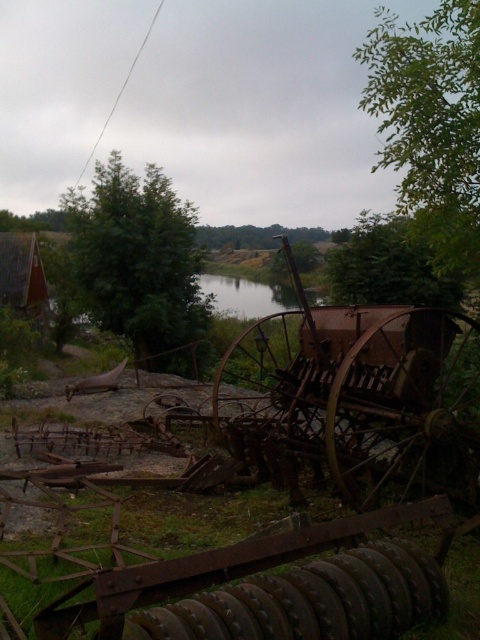
Is point (444, 77) positioned after point (90, 262)?

No, (444, 77) is closer to viewer.

Which is behind, point (443, 13) or point (170, 234)?

The point (170, 234) is behind.

Is point (420, 182) in front of point (137, 244)?

Yes.

Locate an element on the screen. The width and height of the screenshot is (480, 640). green leafy tree at upper right is located at coordinates (431, 124).

Measure the distance from green leafy tree at upper right to green matte tree at upper right.

The distance of green leafy tree at upper right from green matte tree at upper right is 7.73 meters.

Can you confirm if green leafy tree at upper right is positioned below green matte tree at upper right?

No.

Locate an element on the screen. The height and width of the screenshot is (640, 480). green leafy tree at upper right is located at coordinates (431, 124).

Between point (90, 282) and point (379, 291), which one is positioned behind?

The point (90, 282) is more distant.

Where is `green leafy tree at upper left`? green leafy tree at upper left is located at coordinates (140, 266).

Which is behind, point (80, 275) or point (444, 280)?

The point (80, 275) is more distant.

Find the location of `green leafy tree at upper left`. green leafy tree at upper left is located at coordinates (140, 266).